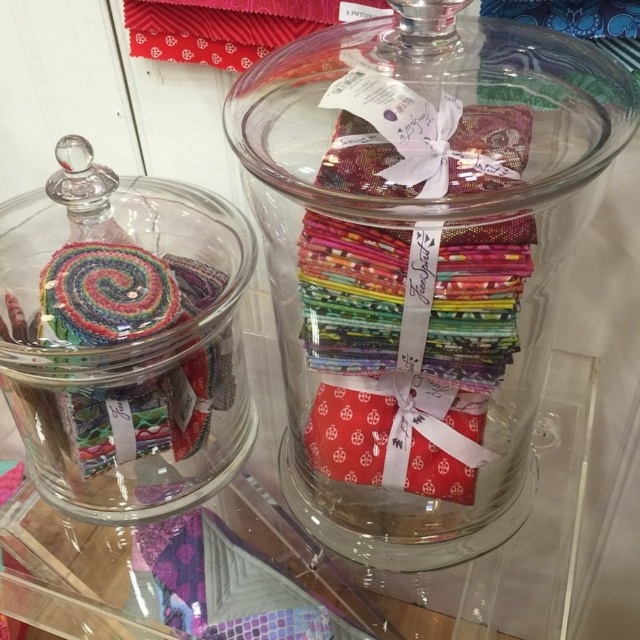
You are organizing a craft fair and need to place a new decorative item between the transparent glass jar at center and the multicolored fabric at left. Based on their positions, which object should the new item be closer to?

The transparent glass jar at center is in front of the multicolored fabric at left, so the new item should be placed closer to the multicolored fabric at left to maintain the spatial arrangement.

You are organizing a craft fair and need to know which container can hold more fabric rolls. The transparent glass jar at center and the multicolored fabric at left are available. Based on their sizes, which one has a larger capacity?

The transparent glass jar at center has a larger width than the multicolored fabric at left, so it can hold more fabric rolls.